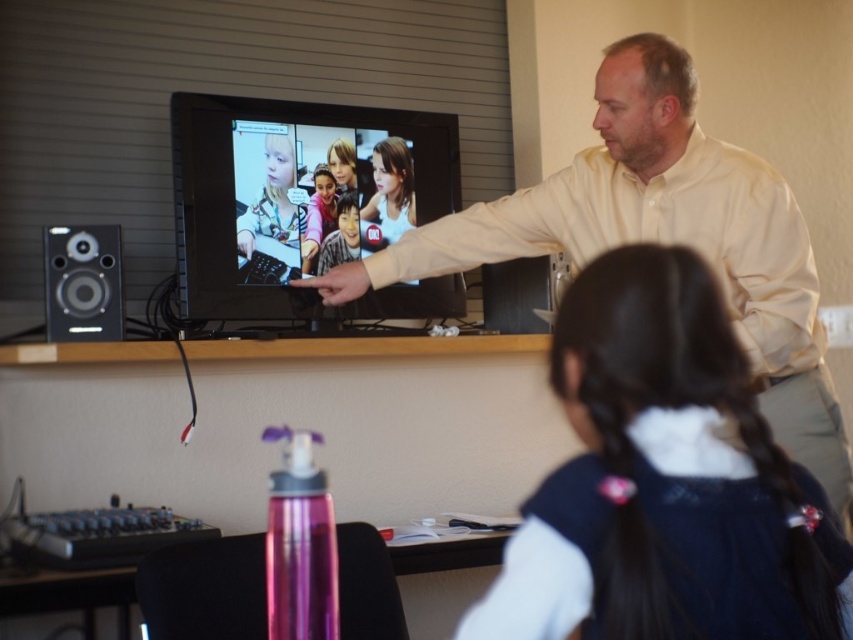
Question: Estimate the real-world distances between objects in this image. Which object is closer to the black silky hair at upper center?

Choices:
 (A) matte black speaker at left
 (B) matte yellow shirt at upper right

Answer: (B)

Question: Which of the following is the closest to the observer?

Choices:
 (A) (602, 182)
 (B) (62, 257)
 (C) (529, 596)

Answer: (C)

Question: Which point is closer to the camera?

Choices:
 (A) matte black speaker at left
 (B) black silky hair at upper center

Answer: (B)

Question: In this image, where is black silky hair at upper center located relative to matte black speaker at left?

Choices:
 (A) right
 (B) left

Answer: (A)

Question: Is black silky hair at upper center wider than matte yellow shirt at upper right?

Choices:
 (A) no
 (B) yes

Answer: (A)

Question: Does matte yellow shirt at upper right have a smaller size compared to matte black speaker at left?

Choices:
 (A) yes
 (B) no

Answer: (B)